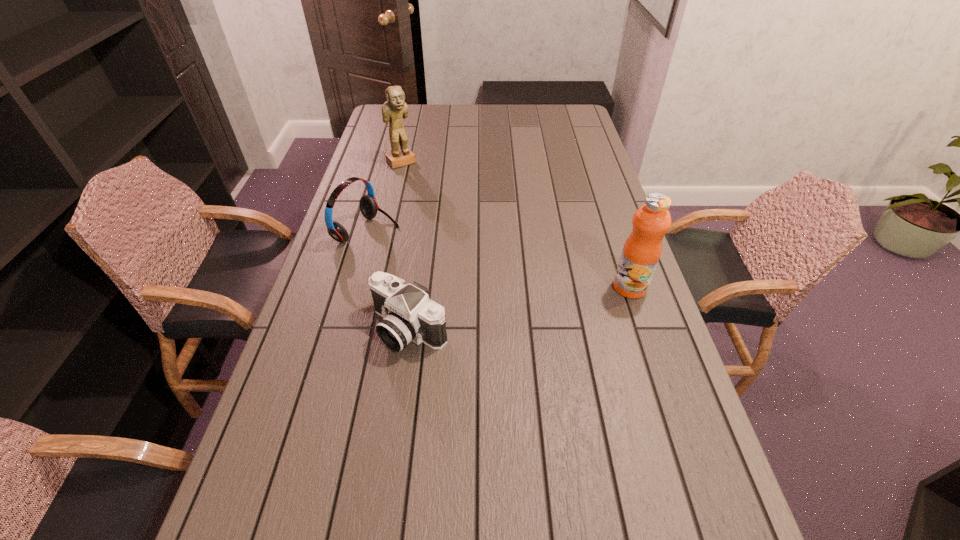
In the image, there is a desktop. Identify the location of vacant space at the right edge. (586, 209).

In the image, there is a desktop. Where is `free space at the far right corner`? The image size is (960, 540). free space at the far right corner is located at coordinates (585, 126).

Find the location of `unoccupied area between the figurine and the headset`. unoccupied area between the figurine and the headset is located at coordinates (384, 197).

The height and width of the screenshot is (540, 960). Identify the location of vacant space that is in between the fruit juice and the second farthest object. (499, 259).

What are the coordinates of `vacant region between the figurine and the fruit juice` in the screenshot? It's located at (516, 225).

Where is `vacant region between the farthest object and the shortest object`? vacant region between the farthest object and the shortest object is located at coordinates (405, 245).

Where is `vacant space that's between the third farthest object and the camera`? This screenshot has width=960, height=540. vacant space that's between the third farthest object and the camera is located at coordinates (519, 308).

Where is `vacant point located between the farthest object and the second farthest object`? Image resolution: width=960 pixels, height=540 pixels. vacant point located between the farthest object and the second farthest object is located at coordinates (384, 197).

Find the location of `vacant point located between the figurine and the shortest object`. vacant point located between the figurine and the shortest object is located at coordinates (405, 245).

This screenshot has height=540, width=960. I want to click on unoccupied area between the headset and the figurine, so (384, 197).